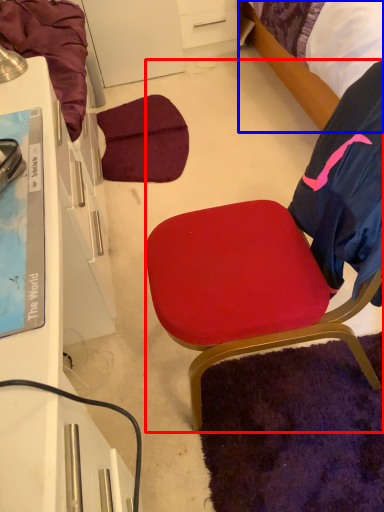
Question: Which of the following is the closest to the observer, chair (highlighted by a red box) or bed (highlighted by a blue box)?

Choices:
 (A) chair
 (B) bed

Answer: (A)